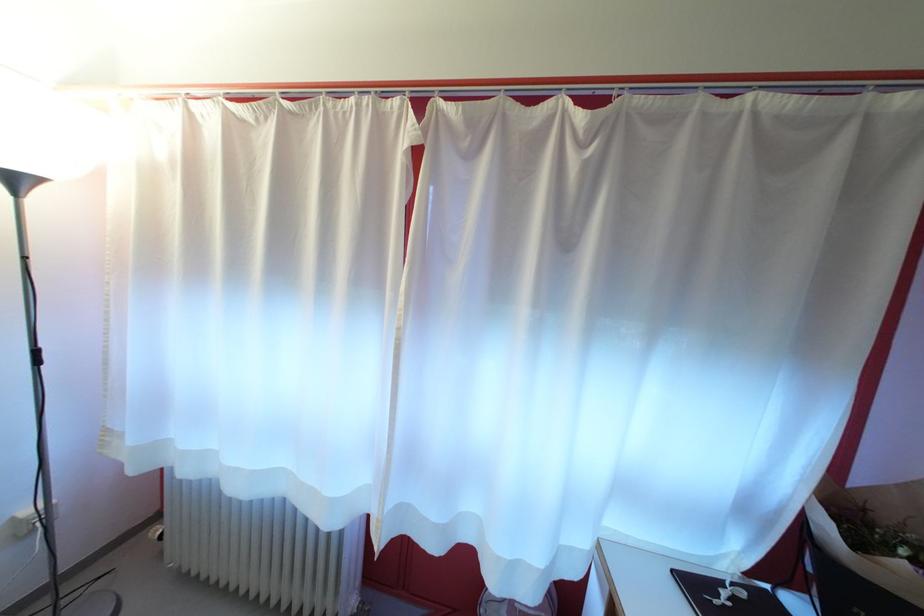
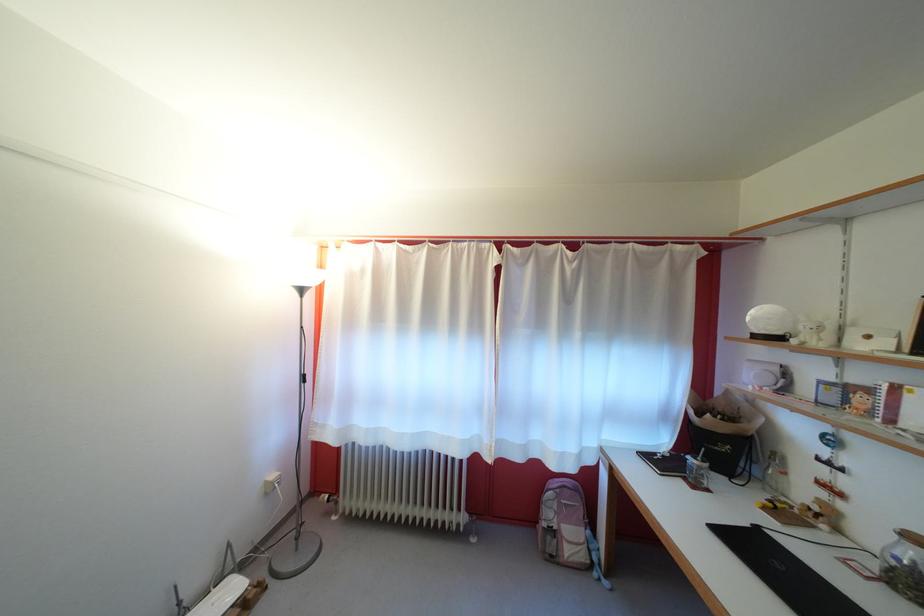
Question: The first image is from the beginning of the video and the second image is from the end. How did the camera likely rotate when shooting the video?

Choices:
 (A) Left
 (B) Right
 (C) Up
 (D) Down

Answer: (C)